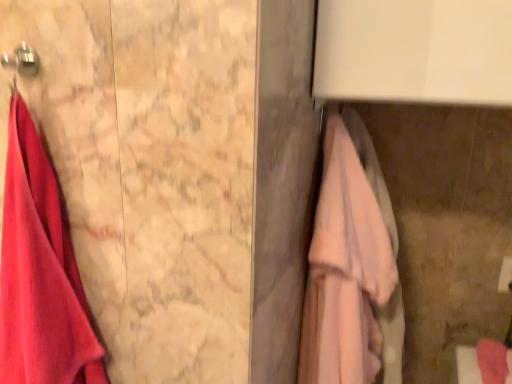
Question: Is matte pink towel at left, the first towel viewed from the left, to the left of metallic hook at upper left from the viewer's perspective?

Choices:
 (A) no
 (B) yes

Answer: (B)

Question: Could you tell me if matte pink towel at left, the second towel in the right-to-left sequence, is facing metallic hook at upper left?

Choices:
 (A) yes
 (B) no

Answer: (B)

Question: Considering the relative sizes of matte pink towel at left, the second towel in the right-to-left sequence, and metallic hook at upper left in the image provided, is matte pink towel at left, the second towel in the right-to-left sequence, taller than metallic hook at upper left?

Choices:
 (A) yes
 (B) no

Answer: (A)

Question: From the image's perspective, does matte pink towel at left, the first towel viewed from the left, appear lower than metallic hook at upper left?

Choices:
 (A) yes
 (B) no

Answer: (A)

Question: From a real-world perspective, is matte pink towel at left, the second towel in the right-to-left sequence, physically below metallic hook at upper left?

Choices:
 (A) no
 (B) yes

Answer: (B)

Question: Can you confirm if matte pink towel at left, the second towel in the right-to-left sequence, is bigger than metallic hook at upper left?

Choices:
 (A) yes
 (B) no

Answer: (A)

Question: From the image's perspective, is pink fabric towel at right, which is counted as the first towel, starting from the right, located above matte pink towel at left, the first towel viewed from the left?

Choices:
 (A) no
 (B) yes

Answer: (A)

Question: From a real-world perspective, is pink fabric towel at right, the second towel viewed from the left, physically above matte pink towel at left, the first towel viewed from the left?

Choices:
 (A) no
 (B) yes

Answer: (A)

Question: Is pink fabric towel at right, the second towel viewed from the left, located outside matte pink towel at left, the first towel viewed from the left?

Choices:
 (A) no
 (B) yes

Answer: (B)

Question: Is pink fabric towel at right, the second towel viewed from the left, shorter than matte pink towel at left, the second towel in the right-to-left sequence?

Choices:
 (A) yes
 (B) no

Answer: (B)

Question: Is pink fabric towel at right, the second towel viewed from the left, positioned behind matte pink towel at left, the second towel in the right-to-left sequence?

Choices:
 (A) yes
 (B) no

Answer: (A)

Question: Would you consider pink fabric towel at right, which is counted as the first towel, starting from the right, to be distant from matte pink towel at left, the second towel in the right-to-left sequence?

Choices:
 (A) no
 (B) yes

Answer: (A)

Question: From a real-world perspective, is metallic hook at upper left located beneath pink fabric towel at right, the second towel viewed from the left?

Choices:
 (A) yes
 (B) no

Answer: (B)